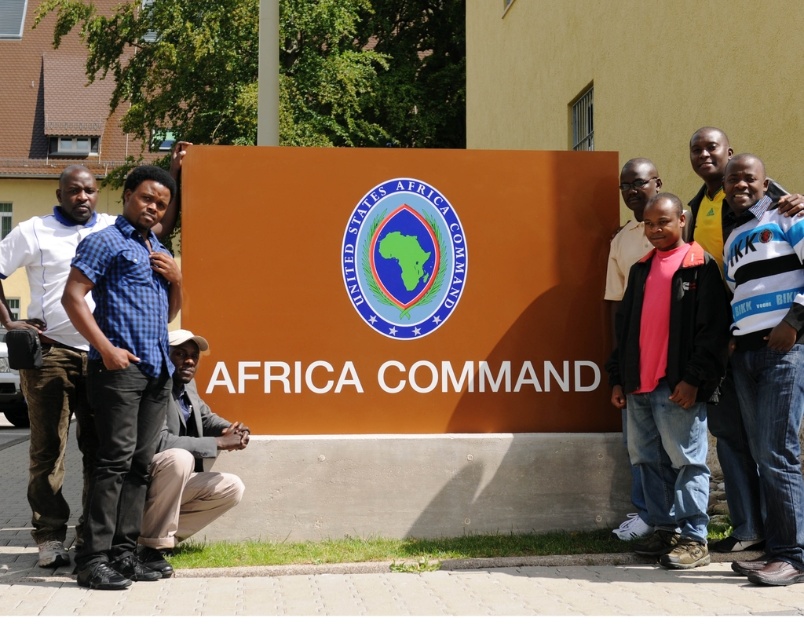
Question: Can you confirm if blue checkered shirt at left is positioned above striped jersey at right?

Choices:
 (A) no
 (B) yes

Answer: (A)

Question: Among these points, which one is nearest to the camera?

Choices:
 (A) (706, 195)
 (B) (160, 221)
 (C) (323, 328)

Answer: (B)

Question: Which of these objects is positioned closest to the striped jersey at right?

Choices:
 (A) blue checkered shirt at left
 (B) pink fabric shirt at right
 (C) khaki fabric pants at lower center
 (D) orange matte sign at center

Answer: (B)

Question: Does blue checkered shirt at left have a greater width compared to striped jersey at right?

Choices:
 (A) no
 (B) yes

Answer: (B)

Question: Can you confirm if orange matte sign at center is smaller than khaki fabric pants at lower center?

Choices:
 (A) yes
 (B) no

Answer: (B)

Question: Which object is positioned closest to the orange matte sign at center?

Choices:
 (A) pink fabric shirt at right
 (B) khaki fabric pants at lower center

Answer: (B)